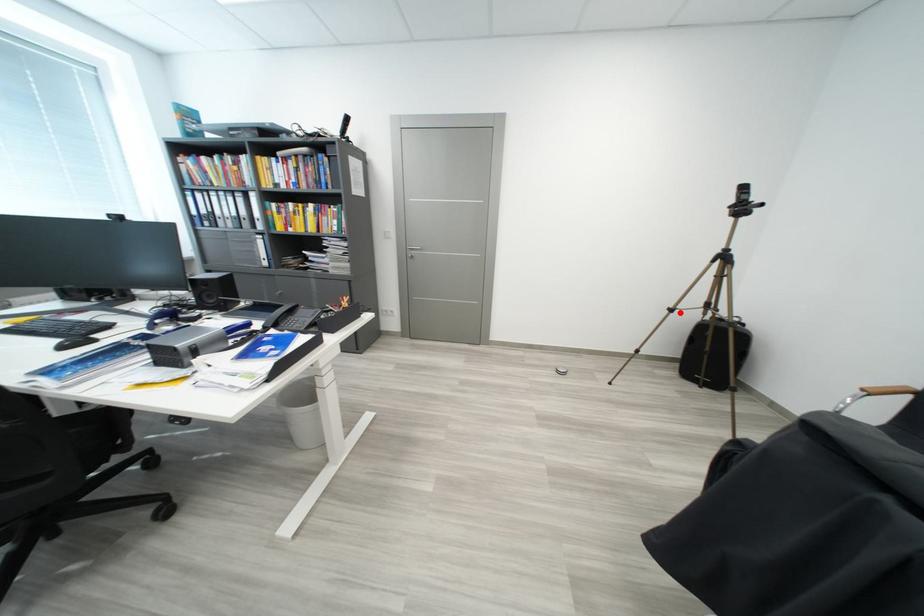
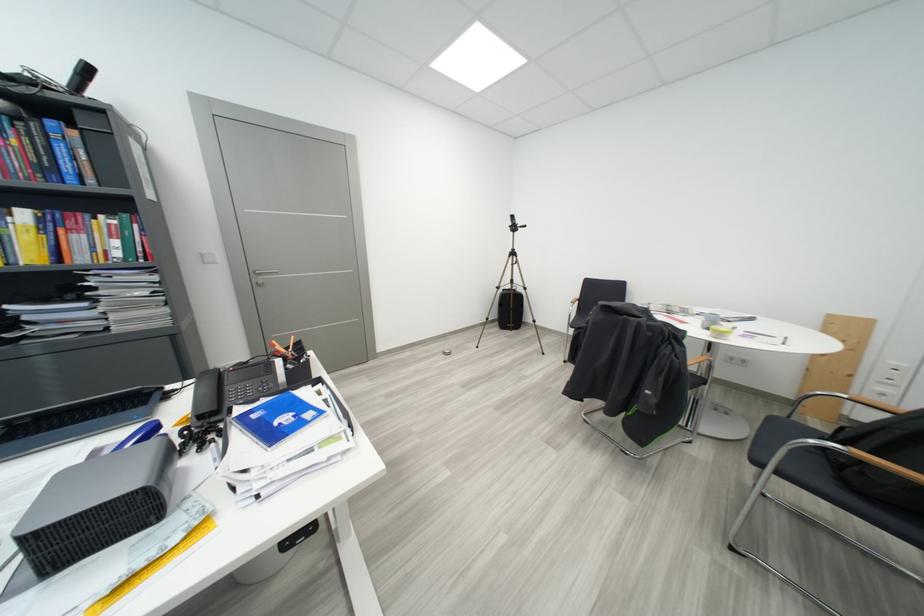
Question: I am providing you with two images of the same scene from different viewpoints. In image1, a red point is highlighted. Considering the same 3D point in image2, which of the following is correct?

Choices:
 (A) It is closer
 (B) It is farther

Answer: (A)